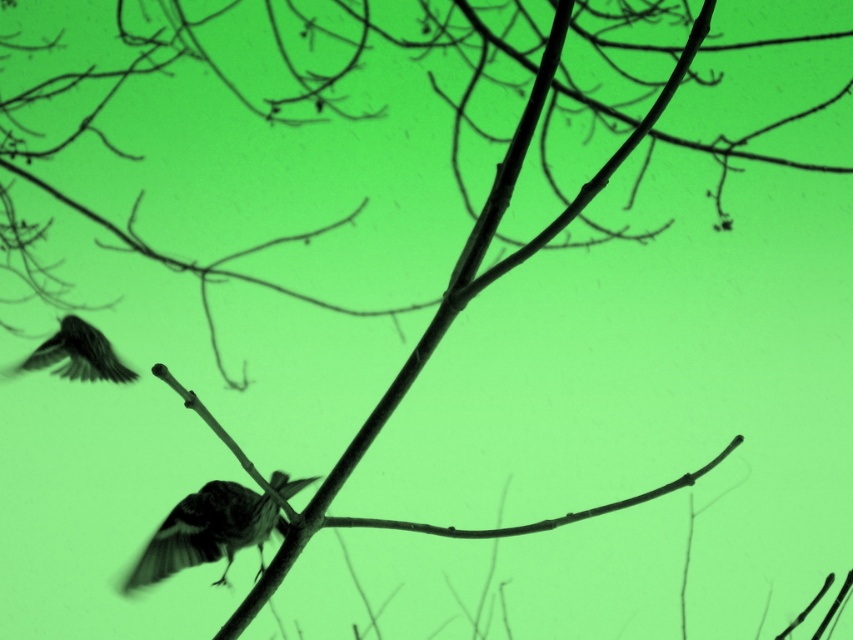
Question: Can you confirm if silvery metallic bird at center is positioned below silky black feathers at lower left?

Choices:
 (A) no
 (B) yes

Answer: (B)

Question: Which point appears farthest from the camera in this image?

Choices:
 (A) (206, 516)
 (B) (91, 372)

Answer: (B)

Question: Can you confirm if silvery metallic bird at center is positioned to the right of silky black feathers at lower left?

Choices:
 (A) no
 (B) yes

Answer: (B)

Question: Does silvery metallic bird at center come in front of silky black feathers at lower left?

Choices:
 (A) yes
 (B) no

Answer: (A)